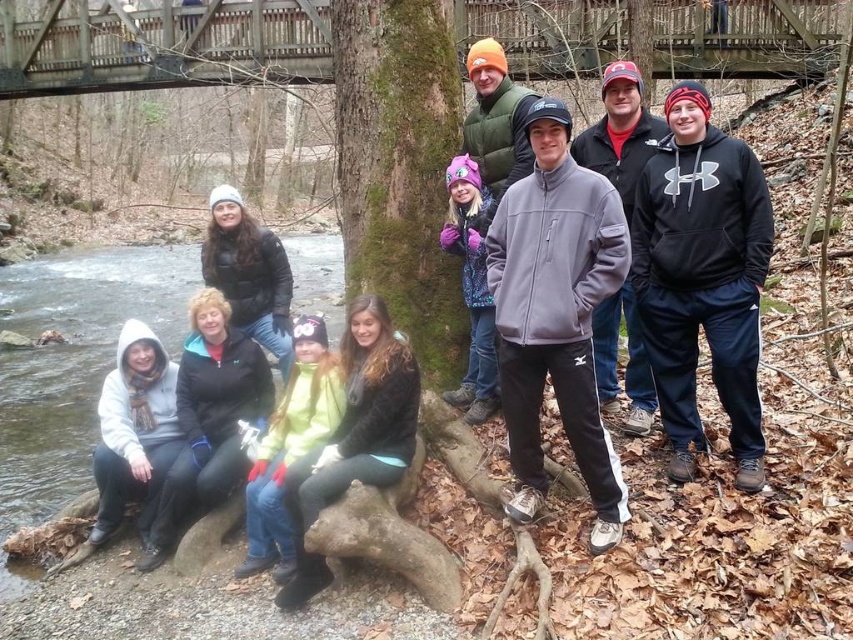
Is black fleece hoodie at center smaller than white fleece jacket at lower left?

Actually, black fleece hoodie at center might be larger than white fleece jacket at lower left.

Is black fleece hoodie at center closer to camera compared to white fleece jacket at lower left?

Yes.

The width and height of the screenshot is (853, 640). Identify the location of black fleece hoodie at center. (701, 278).

Is the position of black fleece jacket at lower left less distant than that of black fleece jacket at center?

No, it is behind black fleece jacket at center.

You are a GUI agent. You are given a task and a screenshot of the screen. Output one action in this format:
    pyautogui.click(x=<x>, y=<y>)
    Task: Click on the black fleece jacket at lower left
    Image resolution: width=853 pixels, height=640 pixels.
    Given the screenshot: What is the action you would take?
    pyautogui.click(x=209, y=420)

Between point (218, 444) and point (639, 336), which one is positioned in front?

Point (639, 336) is more forward.

I want to click on black fleece jacket at lower left, so click(x=209, y=420).

Who is lower down, green mossy tree trunk at center or clear water at stream left?

Positioned lower is clear water at stream left.

Is green mossy tree trunk at center below clear water at stream left?

Incorrect, green mossy tree trunk at center is not positioned below clear water at stream left.

Find the location of a particular element. The width and height of the screenshot is (853, 640). green mossy tree trunk at center is located at coordinates (399, 168).